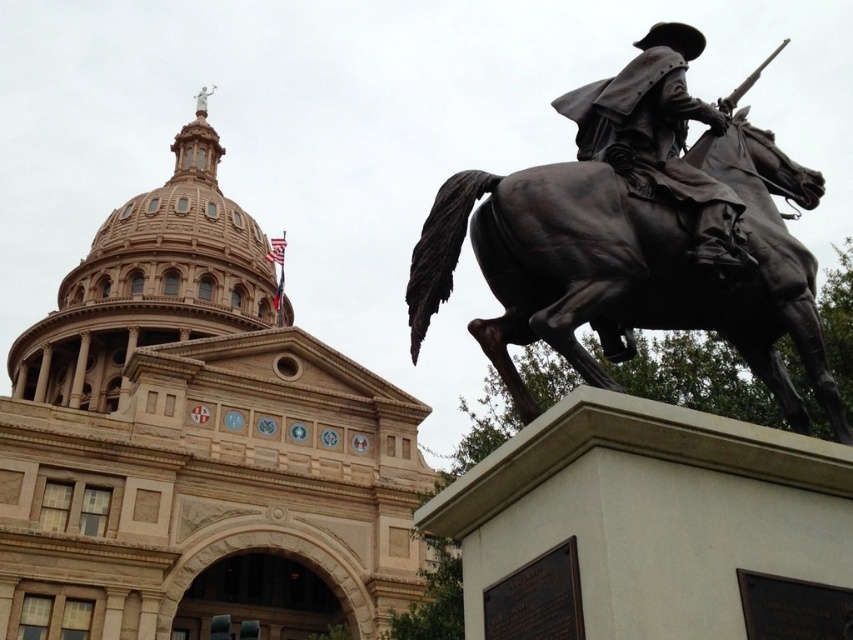
Question: Which of the following is the farthest from the observer?

Choices:
 (A) bronze at right
 (B) bronze statue at center

Answer: (B)

Question: Does bronze at right appear on the left side of bronze statue at center?

Choices:
 (A) yes
 (B) no

Answer: (A)

Question: Can you confirm if bronze at right is smaller than bronze statue at center?

Choices:
 (A) yes
 (B) no

Answer: (B)

Question: Is bronze at right bigger than bronze statue at center?

Choices:
 (A) yes
 (B) no

Answer: (A)